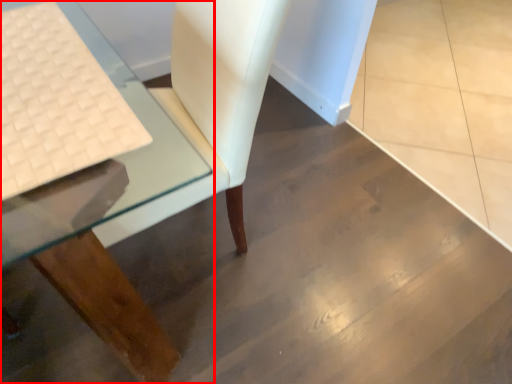
Question: From the image's perspective, what is the correct spatial positioning of table (annotated by the red box) in reference to laptop keyboard?

Choices:
 (A) above
 (B) below

Answer: (A)